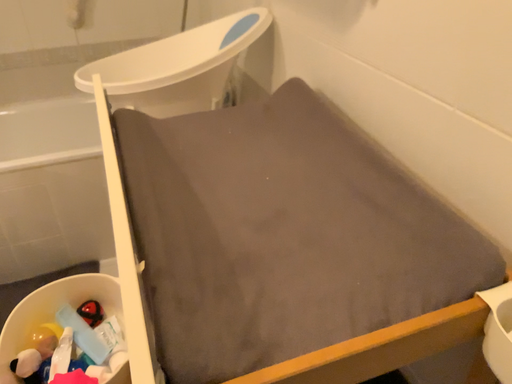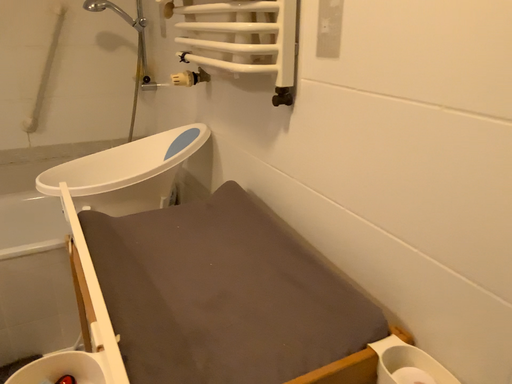
Question: How did the camera likely rotate when shooting the video?

Choices:
 (A) rotated left
 (B) rotated right

Answer: (B)